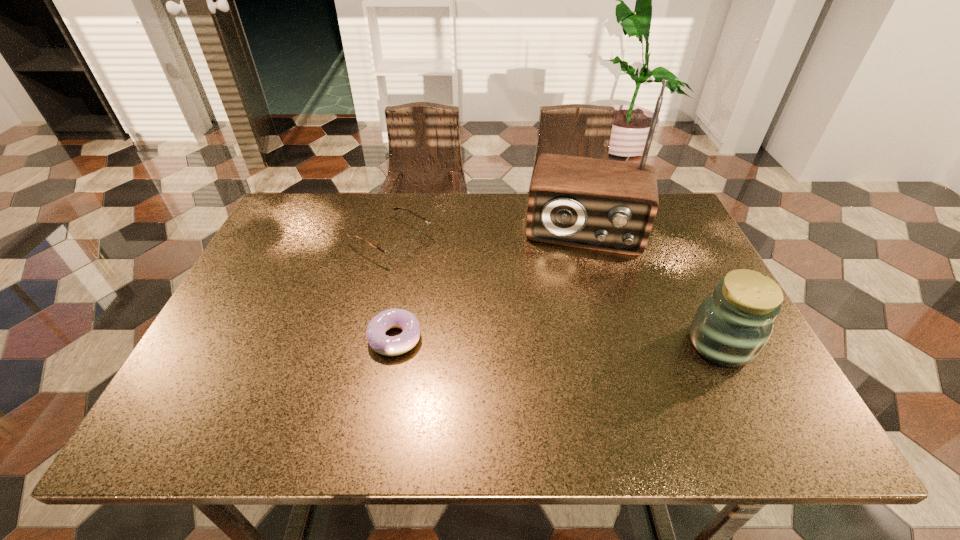
You are a GUI agent. You are given a task and a screenshot of the screen. Output one action in this format:
    pyautogui.click(x=<x>, y=<y>)
    Task: Click on the blank region between the tallest object and the doughnut
    
    Given the screenshot: What is the action you would take?
    pyautogui.click(x=490, y=284)

Where is `free point between the second shortest object and the third shortest object`? This screenshot has width=960, height=540. free point between the second shortest object and the third shortest object is located at coordinates (556, 292).

The width and height of the screenshot is (960, 540). What are the coordinates of `free spot between the second shortest object and the third shortest object` in the screenshot? It's located at (556, 292).

Image resolution: width=960 pixels, height=540 pixels. In order to click on free area in between the jar and the spectacles in this screenshot , I will do `click(556, 292)`.

Select which object is the closest to the second tallest object. Please provide its 2D coordinates. Your answer should be formatted as a tuple, i.e. [(x, y)], where the tuple contains the x and y coordinates of a point satisfying the conditions above.

[(606, 205)]

Locate an element on the screen. object that is the third nearest to the second tallest object is located at coordinates (398, 252).

You are a GUI agent. You are given a task and a screenshot of the screen. Output one action in this format:
    pyautogui.click(x=<x>, y=<y>)
    Task: Click on the free spot that satisfies the following two spatial constraints: 1. on the back side of the shortest object; 2. on the right side of the tallest object
    The height and width of the screenshot is (540, 960).
    Given the screenshot: What is the action you would take?
    pyautogui.click(x=414, y=230)

Where is `vacant region that satisfies the following two spatial constraints: 1. on the back side of the tallest object; 2. on the left side of the shortest object`? This screenshot has height=540, width=960. vacant region that satisfies the following two spatial constraints: 1. on the back side of the tallest object; 2. on the left side of the shortest object is located at coordinates (414, 230).

Identify the location of free space in the image that satisfies the following two spatial constraints: 1. on the front side of the doughnut; 2. on the right side of the spectacles. Image resolution: width=960 pixels, height=540 pixels. (369, 338).